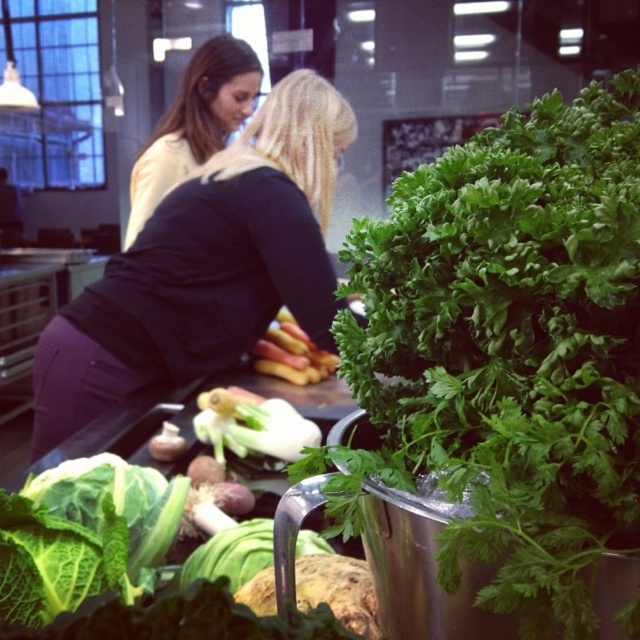
You are standing in the kitchen scene and want to reach both points marked in the image. Which point, point 1 at coordinates (157, 360) or point 2 at coordinates (292, 438), is closer to you?

Point 1 at coordinates (157, 360) is closer to you because it is further to the viewer than point 2 at coordinates (292, 438).

You are a chef in a busy kitchen and need to quickly grab the green leafy parsley at center and white smooth fennel at center for a recipe. Given that you can only reach 24 inches, can you reach both items without moving your position?

The green leafy parsley at center is 26.27 inches away from the white smooth fennel at center, which means the distance between them exceeds your 24 inch reach. Therefore, you cannot reach both items simultaneously without moving your position.

You are a chef trying to decide which item to grab first. The black matte shirt at upper center and the white smooth fennel at center are both in your line of sight. Which one has a greater width?

The black matte shirt at upper center has a greater width than the white smooth fennel at center.